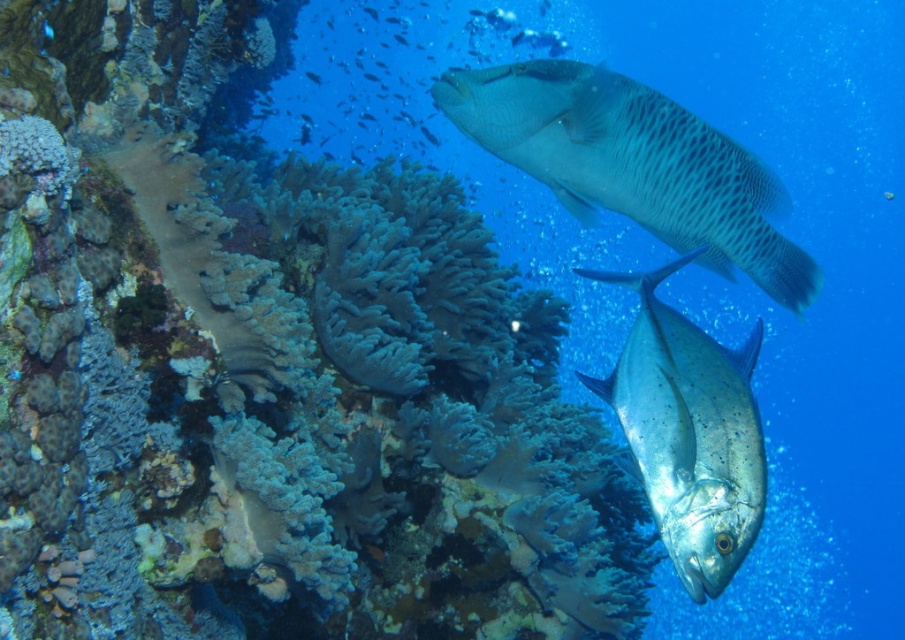
Question: Is soft coral at center below silver metallic fish at center?

Choices:
 (A) yes
 (B) no

Answer: (B)

Question: Based on their relative distances, which object is farther from the silver metallic fish at center?

Choices:
 (A) speckled gray fish at upper center
 (B) soft coral at center

Answer: (B)

Question: Which of the following is the closest to the observer?

Choices:
 (A) speckled gray fish at upper center
 (B) silver metallic fish at center
 (C) soft coral at center

Answer: (B)

Question: Which is nearer to the soft coral at center?

Choices:
 (A) speckled gray fish at upper center
 (B) silver metallic fish at center

Answer: (A)

Question: Is the position of soft coral at center less distant than that of silver metallic fish at center?

Choices:
 (A) no
 (B) yes

Answer: (A)

Question: Does soft coral at center have a larger size compared to silver metallic fish at center?

Choices:
 (A) yes
 (B) no

Answer: (A)